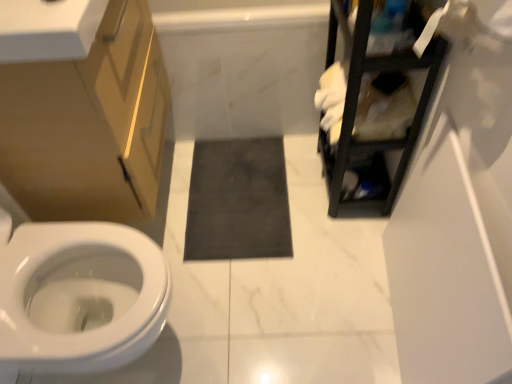
Identify the location of vacant space situated on the left part of black metal shelving unit at upper right. (281, 192).